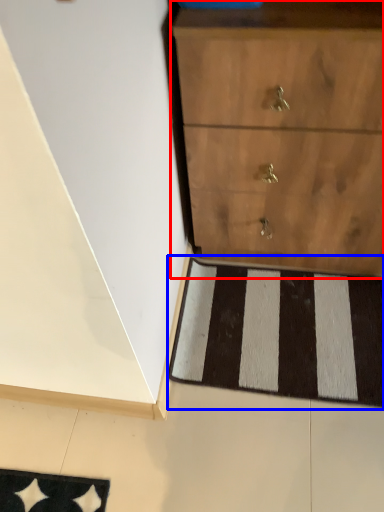
Question: Which object appears closest to the camera in this image, chest of drawers (highlighted by a red box) or doormat (highlighted by a blue box)?

Choices:
 (A) chest of drawers
 (B) doormat

Answer: (A)